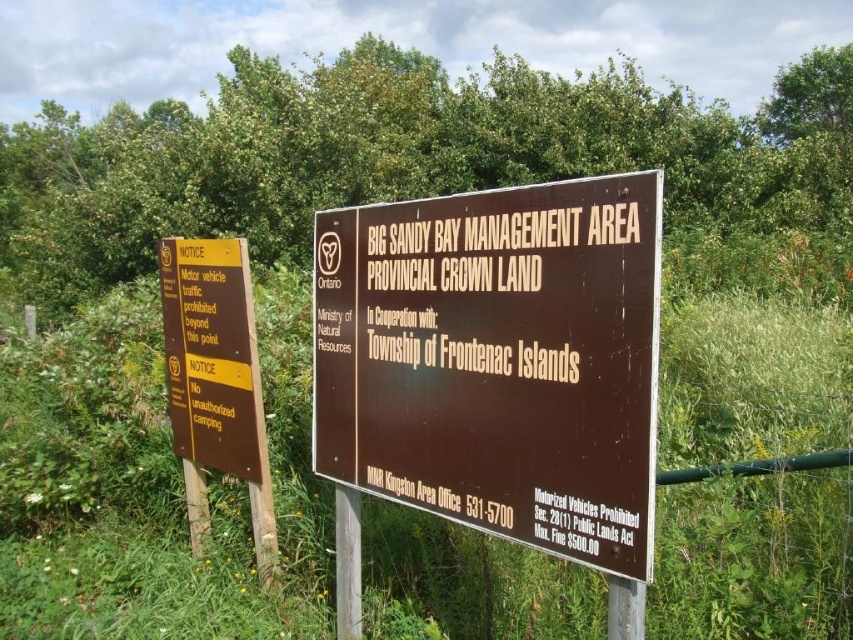
You are standing in a natural area and see the brown wooden sign at center. If you want to read the fine print on the sign without moving closer, what is the minimum magnification power needed for your binoculars? Assume the human eye can read text at 1 foot comfortably and the fine print is 0.5 inches tall.

The brown wooden sign at center is 5.92 feet away. To read 0.5 inch tall text from that distance, the required magnification is calculated by dividing the distance in feet by the comfortable reading distance in feet, then multiplying by the text size ratio. The comfortable reading distance is 1 foot, so 5.92 divided by 1 equals 5.92. The text is 0.5 inches tall, so to make it appear as 1 inch tall at 1 foot, multiply by 2. Thus, 5.92 x 2 equals approximately 11.84x magnification. Therefore, binoculars with

You are a hiker who needs to read both the brown wooden sign at center and the yellow paper at left. Since you have limited time, which one should you read first if you want to get the most information quickly?

The brown wooden sign at center has a larger size compared to yellow paper at left, so you should read the brown wooden sign at center first to get more information quickly.

From the picture: You are a park ranger checking the signage. You need to place a new rectangular sticker that is 10 cm wide on either the brown wooden sign at center or the yellow paper at left. Which object can definitely accommodate the sticker without exceeding its width?

The brown wooden sign at center might be wider than yellow paper at left, so it can definitely accommodate the 10 cm wide sticker without exceeding its width.